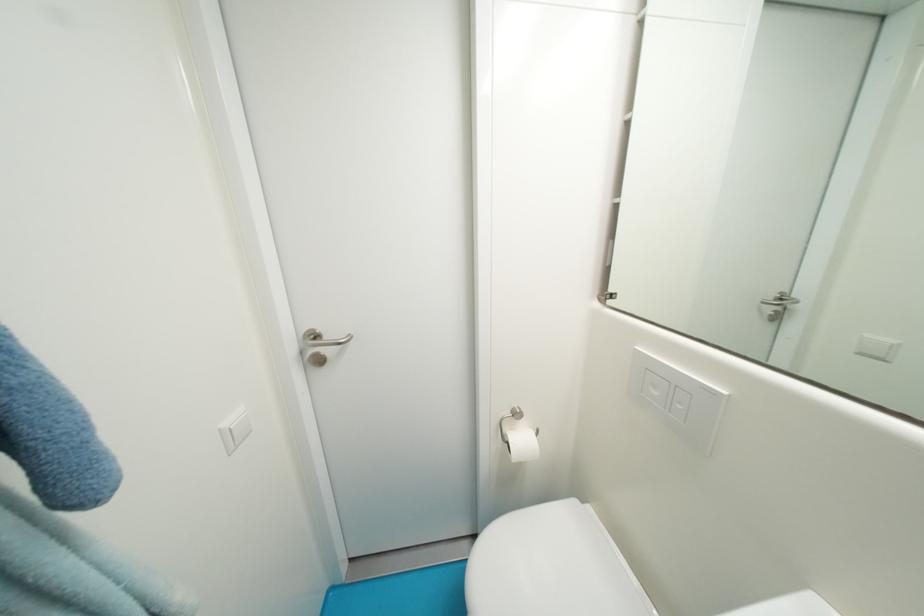
Where would you lift the white toilet lid? Please return your answer as a coordinate pair (x, y).

(551, 565)